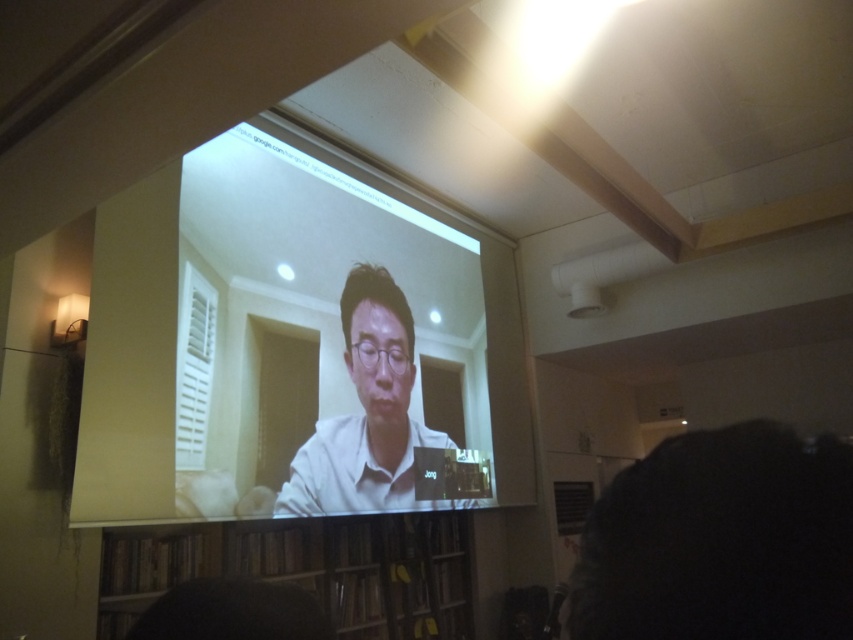
Question: Which point is closer to the camera?

Choices:
 (A) brown wooden bookshelf at lower center
 (B) white glossy projector screen at upper center

Answer: (B)

Question: Is white glossy projector screen at upper center positioned at the back of white matte shirt at center?

Choices:
 (A) no
 (B) yes

Answer: (A)

Question: Is brown wooden bookshelf at lower center smaller than white matte shirt at center?

Choices:
 (A) yes
 (B) no

Answer: (B)

Question: Is white glossy projector screen at upper center below brown wooden bookshelf at lower center?

Choices:
 (A) yes
 (B) no

Answer: (B)

Question: Which object is closer to the camera taking this photo?

Choices:
 (A) white glossy projector screen at upper center
 (B) white matte shirt at center

Answer: (A)

Question: Which is farther from the brown wooden bookshelf at lower center?

Choices:
 (A) white matte shirt at center
 (B) white glossy projector screen at upper center

Answer: (B)